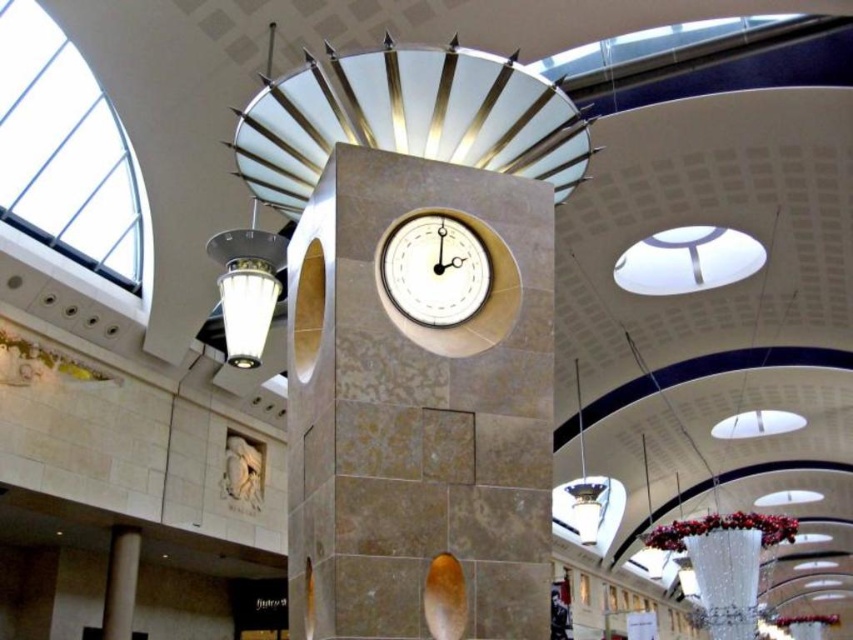
Which of these two, matte stone clock at center or white glossy clock at center, stands shorter?

With less height is white glossy clock at center.

Describe the element at coordinates (419, 403) in the screenshot. I see `matte stone clock at center` at that location.

At what (x,y) coordinates should I click in order to perform the action: click on matte stone clock at center. Please return your answer as a coordinate pair (x, y). Looking at the image, I should click on (419, 403).

This screenshot has width=853, height=640. I want to click on matte stone clock at center, so click(x=419, y=403).

The image size is (853, 640). Describe the element at coordinates (419, 403) in the screenshot. I see `matte stone clock at center` at that location.

Which is more to the left, matte stone clock at center or white stone sculpture at center?

Positioned to the left is white stone sculpture at center.

Who is more forward, (434, 371) or (262, 465)?

Positioned in front is point (434, 371).

This screenshot has height=640, width=853. In order to click on matte stone clock at center in this screenshot , I will do `click(419, 403)`.

Is point (527, 384) positioned in front of point (109, 598)?

Yes, point (527, 384) is closer to viewer.

Is point (392, 232) less distant than point (119, 544)?

Yes.

In order to click on matte stone clock at center in this screenshot , I will do `click(419, 403)`.